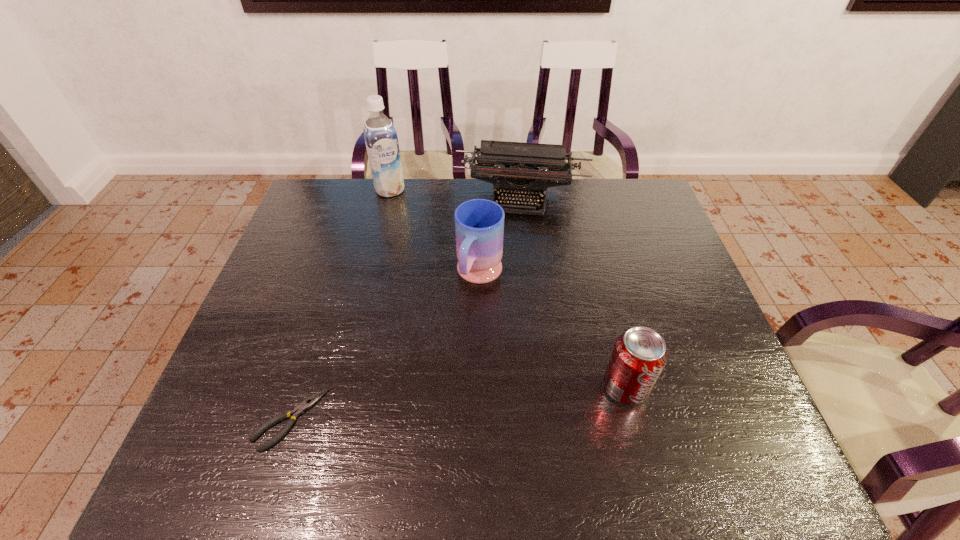
Where is `object located in the left edge section of the desktop`? This screenshot has height=540, width=960. object located in the left edge section of the desktop is located at coordinates (299, 410).

I want to click on object that is at the near left corner, so [299, 410].

Where is `vacant space at the far edge of the desktop`? This screenshot has width=960, height=540. vacant space at the far edge of the desktop is located at coordinates (466, 183).

At what (x,y) coordinates should I click in order to perform the action: click on vacant space at the near edge of the desktop. Please return your answer as a coordinate pair (x, y). The width and height of the screenshot is (960, 540). Looking at the image, I should click on click(622, 423).

Find the location of a particular element. This screenshot has width=960, height=540. vacant space at the right edge of the desktop is located at coordinates (643, 272).

This screenshot has width=960, height=540. Identify the location of vacant region at the far left corner of the desktop. (330, 217).

This screenshot has height=540, width=960. What are the coordinates of `vacant point located between the tallest object and the soda can` in the screenshot? It's located at (508, 288).

Locate an element on the screen. The width and height of the screenshot is (960, 540). vacant area between the typewriter and the tallest object is located at coordinates (456, 194).

Image resolution: width=960 pixels, height=540 pixels. Identify the location of vacant area that lies between the typewriter and the soda can. (573, 292).

This screenshot has height=540, width=960. Find the location of `free space between the typewriter and the shortest object`. free space between the typewriter and the shortest object is located at coordinates (406, 308).